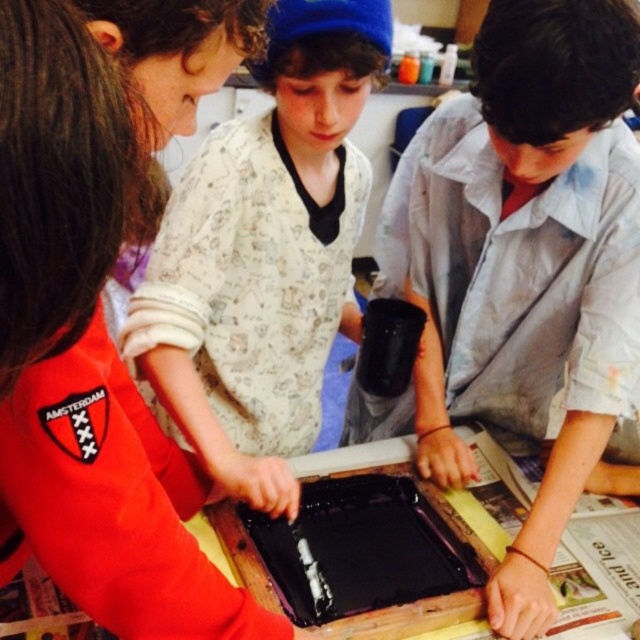
You are a teacher in a classroom. You need to check if the distance between the matte white shirt at center and the black plastic tray at center is less than 10 inches. Can you confirm this?

The distance between the matte white shirt at center and the black plastic tray at center is 9.72 inches, which is less than 10 inches.

You are a teacher observing the children in the classroom. You notice the matte black tray at center and the light gray cotton shirt at center. Can you determine which object is positioned lower in the image?

The matte black tray at center is located below the light gray cotton shirt at center, so it is positioned lower in the image.